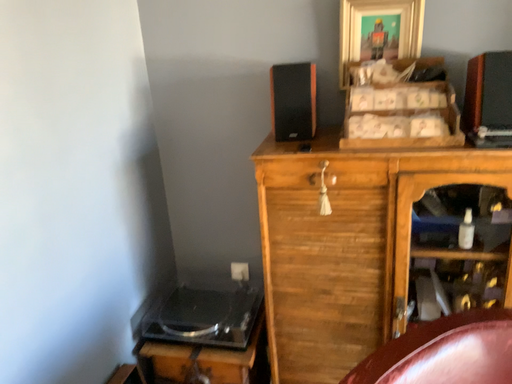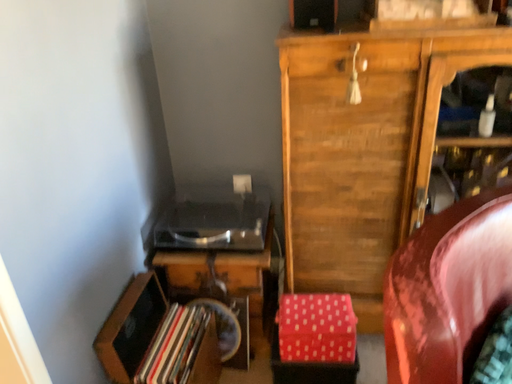
Question: Which way did the camera rotate in the video?

Choices:
 (A) rotated upward
 (B) rotated downward

Answer: (B)